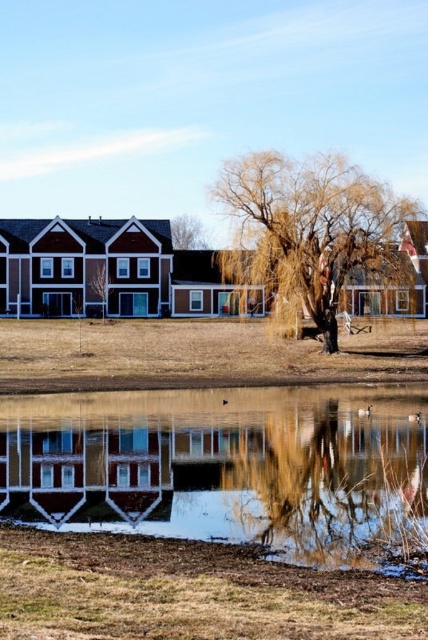
You are standing at the edge of the water and want to take a photo of the brown textured tree at upper center. However, there is a reflective glass puddle at lower center in the way. Can you see the tree through the puddle?

The reflective glass puddle at lower center is in front of the brown textured tree at upper center, so the puddle would block the direct view of the tree, making it impossible to see the tree through the puddle.

You are a gardener planning to mow the lawn. You see the dry grass at center and the brown textured tree at upper center. Which object is taller?

The dry grass at center is taller than the brown textured tree at upper center according to the description.